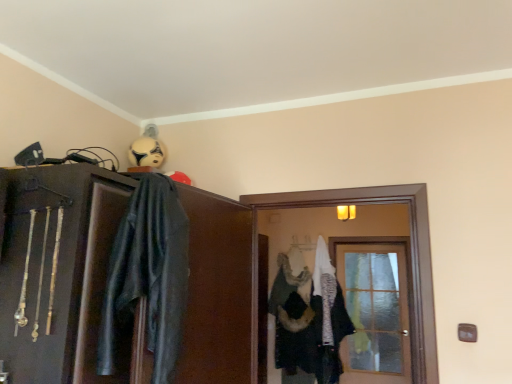
Question: Is matte black cabinet at upper left completely or partially inside white fuzzy coat at center?

Choices:
 (A) no
 (B) yes

Answer: (A)

Question: Considering the relative sizes of white fuzzy coat at center and matte black cabinet at upper left in the image provided, is white fuzzy coat at center taller than matte black cabinet at upper left?

Choices:
 (A) no
 (B) yes

Answer: (B)

Question: Is white fuzzy coat at center to the right of matte black cabinet at upper left from the viewer's perspective?

Choices:
 (A) no
 (B) yes

Answer: (B)

Question: Is white fuzzy coat at center not near matte black cabinet at upper left?

Choices:
 (A) yes
 (B) no

Answer: (A)

Question: From a real-world perspective, is white fuzzy coat at center on top of matte black cabinet at upper left?

Choices:
 (A) yes
 (B) no

Answer: (B)

Question: Is white fuzzy coat at center closer to the viewer compared to matte black cabinet at upper left?

Choices:
 (A) no
 (B) yes

Answer: (A)

Question: From a real-world perspective, is fur-like fabric hanger at center positioned under white matte helmet at upper center based on gravity?

Choices:
 (A) yes
 (B) no

Answer: (A)

Question: Can you see fur-like fabric hanger at center touching white matte helmet at upper center?

Choices:
 (A) no
 (B) yes

Answer: (A)

Question: Is fur-like fabric hanger at center positioned before white matte helmet at upper center?

Choices:
 (A) yes
 (B) no

Answer: (B)

Question: Is fur-like fabric hanger at center thinner than white matte helmet at upper center?

Choices:
 (A) yes
 (B) no

Answer: (A)

Question: Considering the relative positions of fur-like fabric hanger at center and white matte helmet at upper center in the image provided, is fur-like fabric hanger at center to the right of white matte helmet at upper center from the viewer's perspective?

Choices:
 (A) yes
 (B) no

Answer: (A)

Question: Can you confirm if fur-like fabric hanger at center is positioned to the left of white matte helmet at upper center?

Choices:
 (A) yes
 (B) no

Answer: (B)

Question: Is matte black cabinet at upper left smaller than fur-like fabric hanger at center?

Choices:
 (A) yes
 (B) no

Answer: (B)